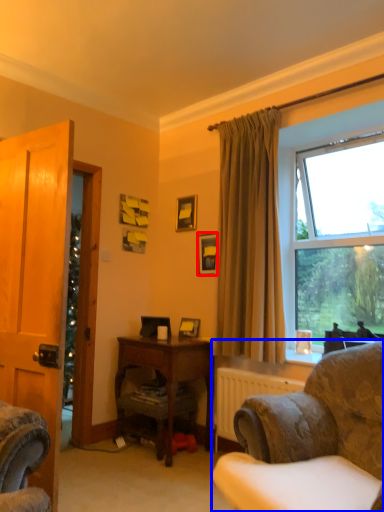
Question: Which object appears closest to the camera in this image, picture frame (highlighted by a red box) or chair (highlighted by a blue box)?

Choices:
 (A) picture frame
 (B) chair

Answer: (B)